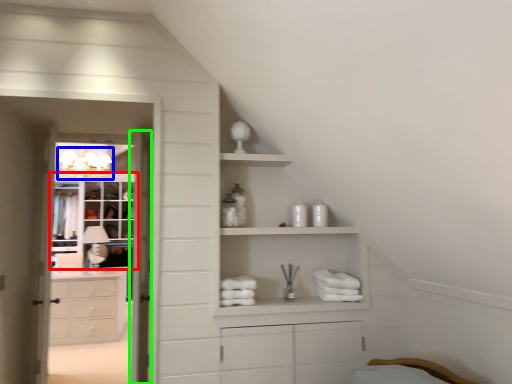
Question: Which object is the closest to the cupboard (highlighted by a red box)? Choose among these: light fixture (highlighted by a blue box) or door (highlighted by a green box).

Choices:
 (A) light fixture
 (B) door

Answer: (A)